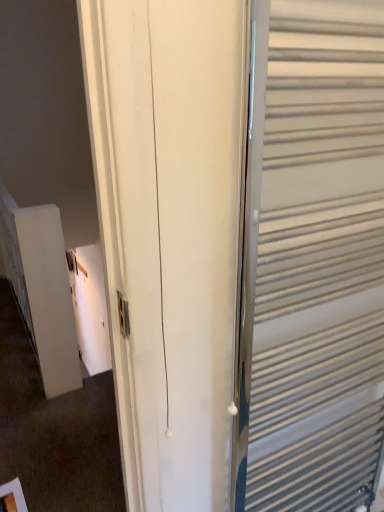
This screenshot has width=384, height=512. Describe the element at coordinates (312, 259) in the screenshot. I see `metallic silver garage door at right` at that location.

Image resolution: width=384 pixels, height=512 pixels. I want to click on metallic silver garage door at right, so click(312, 259).

Find the location of a particular element. metallic silver garage door at right is located at coordinates (312, 259).